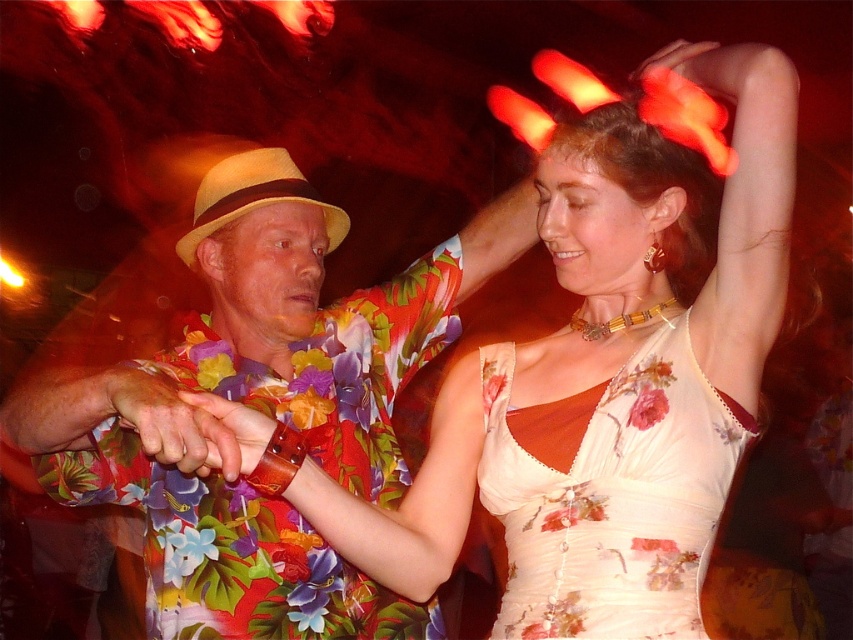
Question: Which object appears closest to the camera in this image?

Choices:
 (A) beige straw cowboy hat at center
 (B) white floral dress at center

Answer: (B)

Question: Can you confirm if floral silk dress at center is thinner than beige straw cowboy hat at center?

Choices:
 (A) no
 (B) yes

Answer: (A)

Question: Is white floral dress at center to the right of floral silk dress at center from the viewer's perspective?

Choices:
 (A) no
 (B) yes

Answer: (A)

Question: Which object is positioned farthest from the white floral dress at center?

Choices:
 (A) beige straw cowboy hat at center
 (B) floral silk dress at center

Answer: (A)

Question: Can you confirm if floral silk dress at center is positioned to the left of beige straw cowboy hat at center?

Choices:
 (A) yes
 (B) no

Answer: (B)

Question: Which of these objects is positioned farthest from the beige straw cowboy hat at center?

Choices:
 (A) floral silk dress at center
 (B) white floral dress at center

Answer: (A)